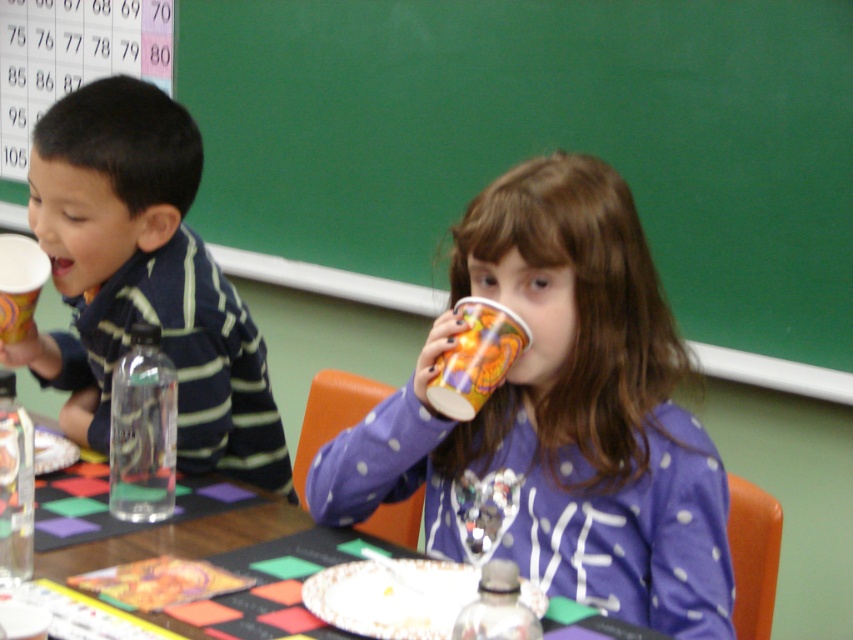
Question: Which object is closer to the camera taking this photo?

Choices:
 (A) metallic silver bottle at lower center
 (B) clear plastic bottle at lower left

Answer: (A)

Question: Does green chalkboard at upper center have a greater width compared to transparent plastic bottle at center?

Choices:
 (A) no
 (B) yes

Answer: (B)

Question: Is matte black shirt at left positioned behind metallic silver bottle at lower center?

Choices:
 (A) no
 (B) yes

Answer: (B)

Question: Among these points, which one is nearest to the camera?

Choices:
 (A) (173, 500)
 (B) (287, 184)
 (C) (7, 480)

Answer: (C)

Question: Does green chalkboard at upper center have a lesser width compared to matte paper cup at upper right?

Choices:
 (A) yes
 (B) no

Answer: (B)

Question: Which object appears closest to the camera in this image?

Choices:
 (A) green chalkboard at upper center
 (B) metallic silver bottle at lower center

Answer: (B)